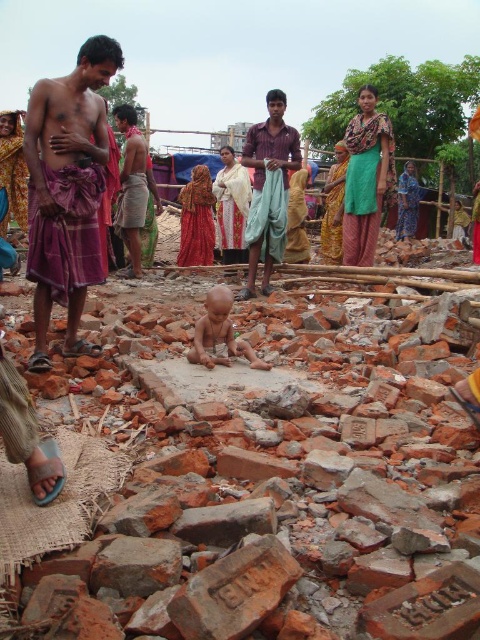
You are a photographer trying to capture a photo of the purple clothed man at left and the light brown skin baby at center. Which subject should you focus on first if you want to include both in the frame without moving the camera?

The purple clothed man at left is positioned on the left side of light brown skin baby at center, so you should focus on the purple clothed man at left first to ensure both are in the frame.